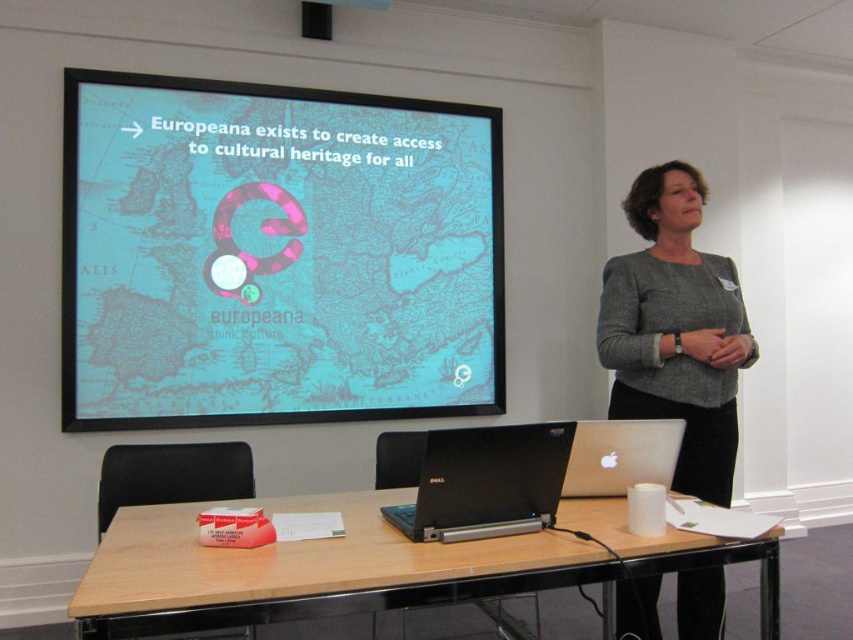
Question: Which of the following is the farthest from the observer?

Choices:
 (A) wooden table at lower center
 (B) silver metallic laptop at center
 (C) black matte laptop at center

Answer: (B)

Question: Is wooden table at lower center above black matte laptop at center?

Choices:
 (A) no
 (B) yes

Answer: (A)

Question: Which point appears closest to the camera in this image?

Choices:
 (A) (769, 593)
 (B) (367, 0)
 (C) (624, 472)

Answer: (A)

Question: Does teal matte/blackboard at upper left have a smaller size compared to wooden table at lower center?

Choices:
 (A) no
 (B) yes

Answer: (A)

Question: Which object appears closest to the camera in this image?

Choices:
 (A) silver metallic laptop at center
 (B) gray sweater at upper right

Answer: (B)

Question: Where is teal matte/blackboard at upper left located in relation to wooden table at lower center in the image?

Choices:
 (A) above
 (B) below

Answer: (A)